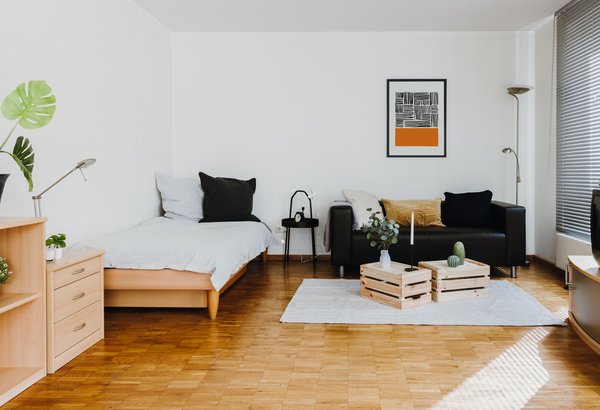
At what (x,y) coordinates should I click in order to perform the action: click on couch. Please return your answer as a coordinate pair (x, y). This screenshot has width=600, height=410. Looking at the image, I should click on (480, 227).